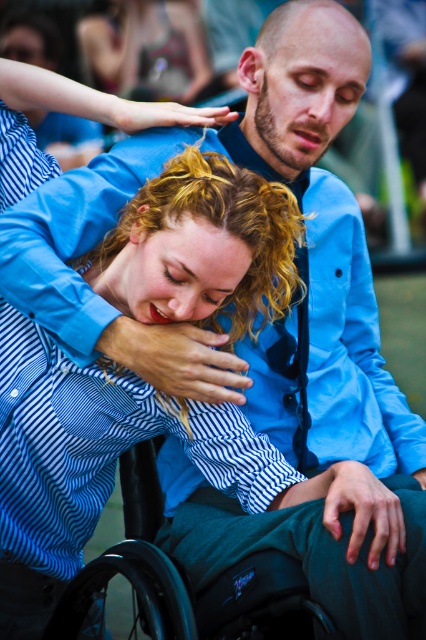
Question: Can you confirm if black plastic wheelchair at lower center is smaller than matte black hair at upper left?

Choices:
 (A) yes
 (B) no

Answer: (A)

Question: Among these objects, which one is farthest from the camera?

Choices:
 (A) matte black hair at upper left
 (B) matte blue shirt at center
 (C) matte blue shirt at upper left

Answer: (A)

Question: Which is farther from the matte black hair at upper left?

Choices:
 (A) matte blue shirt at center
 (B) matte blue shirt at upper left

Answer: (A)

Question: Is black plastic wheelchair at lower center above matte blue shirt at upper left?

Choices:
 (A) no
 (B) yes

Answer: (A)

Question: Is matte black hair at upper left thinner than matte blue shirt at center?

Choices:
 (A) yes
 (B) no

Answer: (B)

Question: Which is farther from the black plastic wheelchair at lower center?

Choices:
 (A) matte blue shirt at center
 (B) matte black hair at upper left
 (C) curly blonde hair at center

Answer: (B)